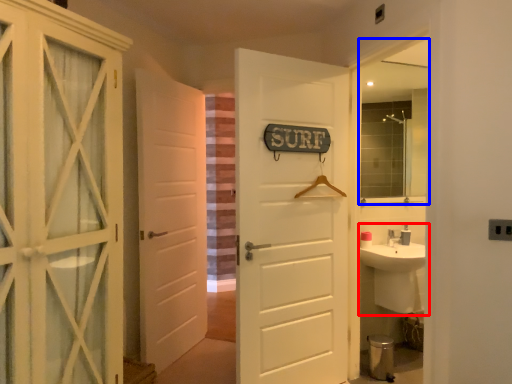
Question: Which object is further to the camera taking this photo, sink (highlighted by a red box) or mirror (highlighted by a blue box)?

Choices:
 (A) sink
 (B) mirror

Answer: (B)